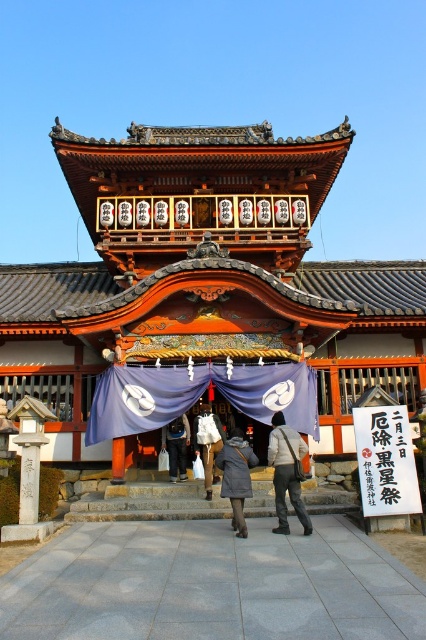
Question: Does light gray fabric jacket at center appear over dark gray wool coat at center?

Choices:
 (A) no
 (B) yes

Answer: (B)

Question: Which is farther from the white paper sign at center?

Choices:
 (A) white cotton bag at center
 (B) dark gray wool coat at center
 (C) dark gray fabric bag at center
 (D) light gray fabric jacket at center

Answer: (C)

Question: Is light gray fabric jacket at center thinner than dark gray fabric bag at center?

Choices:
 (A) yes
 (B) no

Answer: (B)

Question: Which of the following is the closest to the observer?

Choices:
 (A) (206, 406)
 (B) (215, 461)

Answer: (B)

Question: Is white paper sign at center smaller than dark gray fabric bag at center?

Choices:
 (A) yes
 (B) no

Answer: (B)

Question: Which of the following is the closest to the observer?

Choices:
 (A) click(196, 422)
 (B) click(296, 502)
 (C) click(175, 467)
 (D) click(362, 428)

Answer: (B)